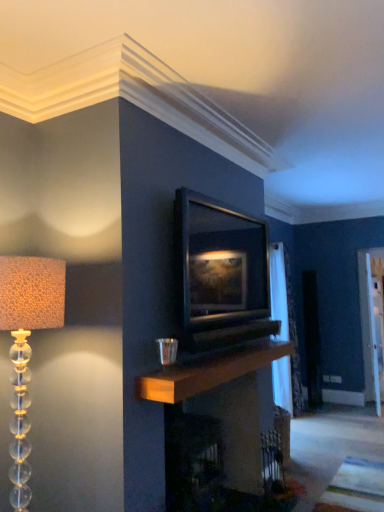
Question: Can you confirm if matte black picture frame at center is shorter than white sheer curtain at right?

Choices:
 (A) no
 (B) yes

Answer: (B)

Question: Is matte black picture frame at center positioned with its back to white sheer curtain at right?

Choices:
 (A) no
 (B) yes

Answer: (A)

Question: Is matte black picture frame at center to the right of white sheer curtain at right from the viewer's perspective?

Choices:
 (A) no
 (B) yes

Answer: (A)

Question: From the image's perspective, is matte black picture frame at center beneath white sheer curtain at right?

Choices:
 (A) no
 (B) yes

Answer: (A)

Question: Does matte black picture frame at center have a greater width compared to white sheer curtain at right?

Choices:
 (A) yes
 (B) no

Answer: (B)

Question: Are matte black picture frame at center and white sheer curtain at right far apart?

Choices:
 (A) yes
 (B) no

Answer: (A)

Question: Is translucent glass lampshade at left closer to camera compared to wooden mantle at center?

Choices:
 (A) yes
 (B) no

Answer: (A)

Question: From the image's perspective, does translucent glass lampshade at left appear higher than wooden mantle at center?

Choices:
 (A) yes
 (B) no

Answer: (A)

Question: From the image's perspective, would you say translucent glass lampshade at left is shown under wooden mantle at center?

Choices:
 (A) yes
 (B) no

Answer: (B)

Question: Can you confirm if translucent glass lampshade at left is smaller than wooden mantle at center?

Choices:
 (A) no
 (B) yes

Answer: (A)

Question: Does translucent glass lampshade at left have a greater width compared to wooden mantle at center?

Choices:
 (A) no
 (B) yes

Answer: (B)

Question: Is translucent glass lampshade at left thinner than wooden mantle at center?

Choices:
 (A) no
 (B) yes

Answer: (A)

Question: Does translucent glass lampshade at left have a smaller size compared to matte black picture frame at center?

Choices:
 (A) yes
 (B) no

Answer: (B)